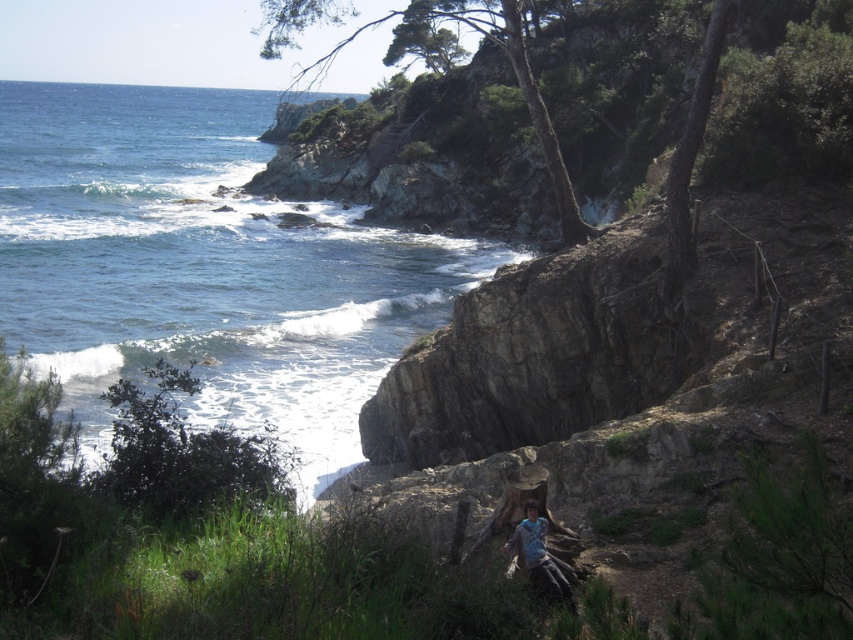
Question: Can you confirm if blue water at lower left is smaller than blue denim jeans at lower center?

Choices:
 (A) no
 (B) yes

Answer: (A)

Question: In this image, where is blue water at lower left located relative to blue denim jeans at lower center?

Choices:
 (A) below
 (B) above

Answer: (B)

Question: Observing the image, what is the correct spatial positioning of blue water at lower left in reference to blue denim jeans at lower center?

Choices:
 (A) right
 (B) left

Answer: (B)